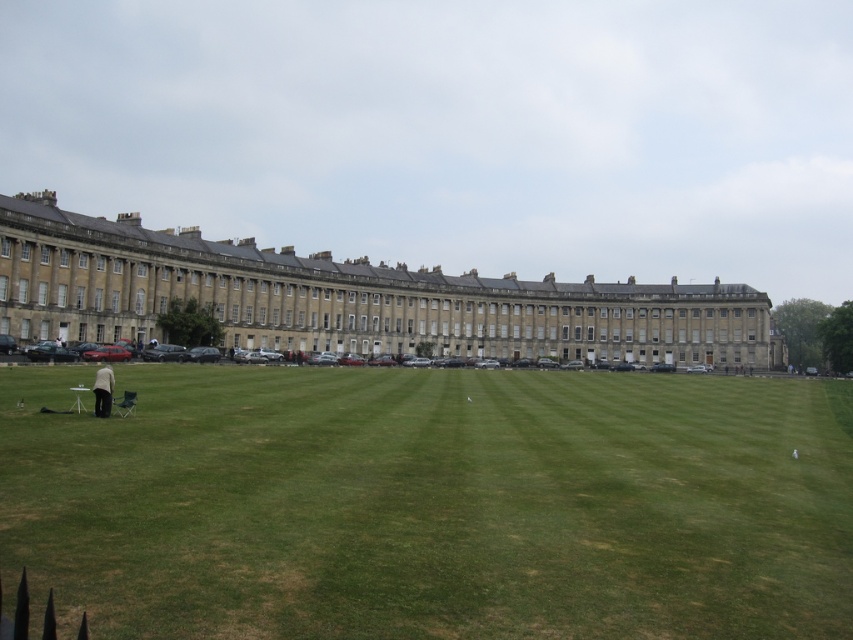
Question: Which object is positioned farthest from the beige stone palace at center?

Choices:
 (A) green grass at center
 (B) light beige fabric jacket at lower left

Answer: (B)

Question: Which object is the closest to the green grass at center?

Choices:
 (A) light beige fabric jacket at lower left
 (B) beige stone palace at center

Answer: (A)

Question: Can you confirm if beige stone palace at center is positioned above light beige fabric jacket at lower left?

Choices:
 (A) no
 (B) yes

Answer: (B)

Question: Considering the relative positions of green grass at center and light beige fabric jacket at lower left in the image provided, where is green grass at center located with respect to light beige fabric jacket at lower left?

Choices:
 (A) left
 (B) right

Answer: (B)

Question: Can you confirm if green grass at center is bigger than light beige fabric jacket at lower left?

Choices:
 (A) yes
 (B) no

Answer: (A)

Question: Which point is closer to the camera?

Choices:
 (A) (672, 452)
 (B) (12, 300)

Answer: (A)